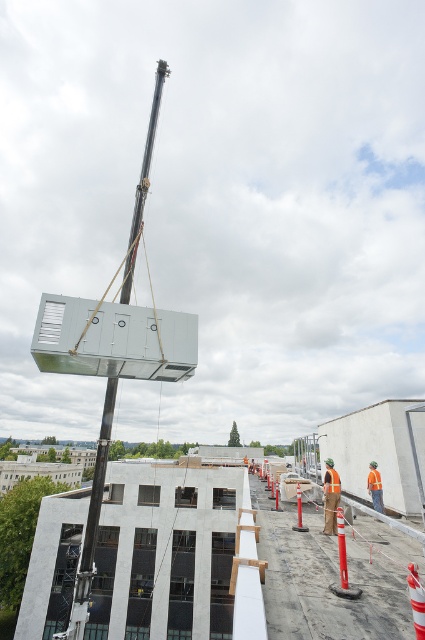
You are standing at the camera position and need to place a safety barrier 5 meters away from where you are standing. Can you use the orange plastic traffic cone at lower right as a reference point for placing the barrier?

The orange plastic traffic cone at lower right is 4.90 meters away from the camera. Since the required distance is 5 meters, the cone is slightly closer than needed. You would need to move about 10 centimeters beyond the cone to reach the 5 meter mark.